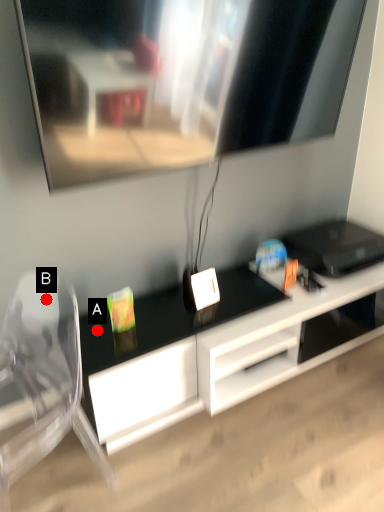
Question: Two points are circled on the image, labeled by A and B beside each circle. Which of the following is the farthest from the observer?

Choices:
 (A) A is further
 (B) B is further

Answer: (B)